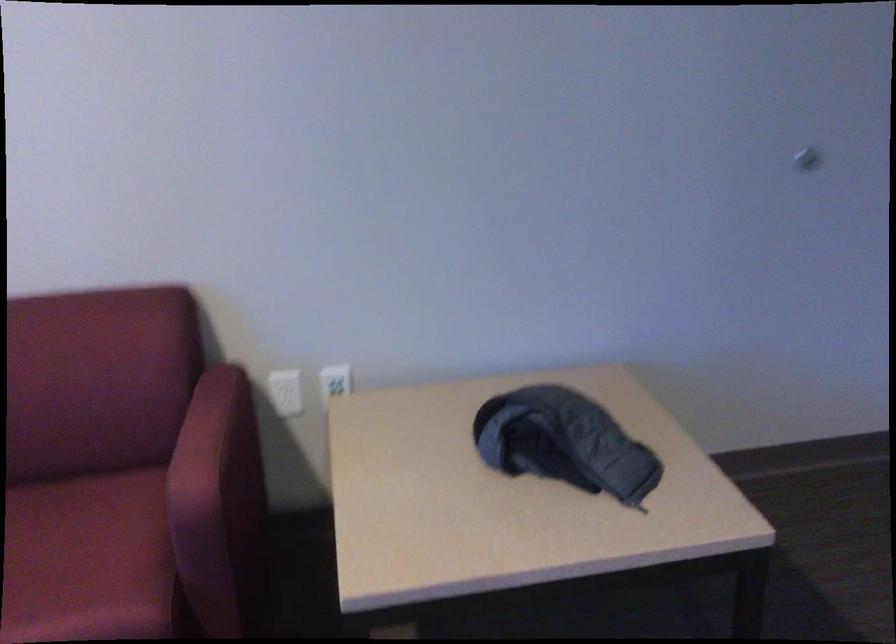
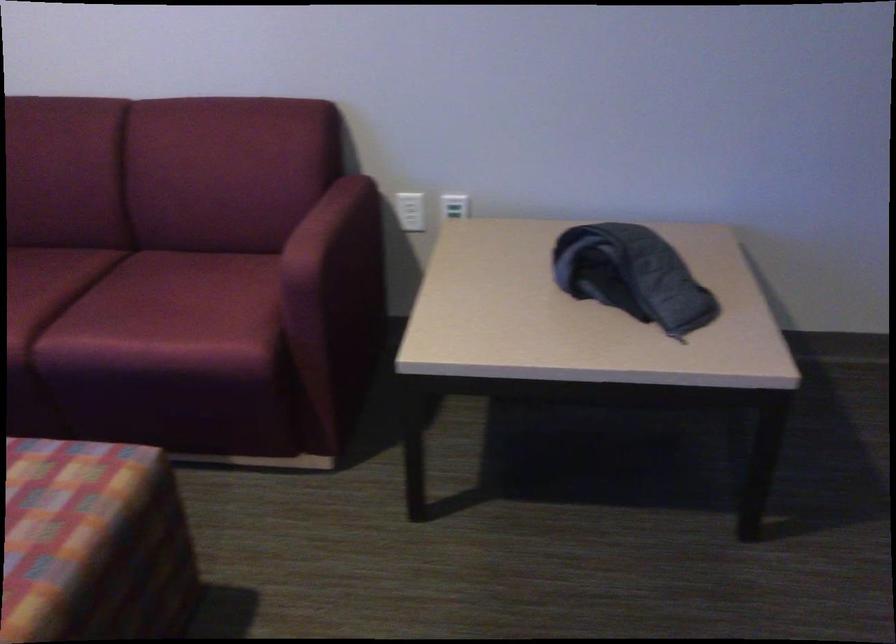
Question: The camera is either moving clockwise (left) or counter-clockwise (right) around the object. The first image is from the beginning of the video and the second image is from the end. Is the camera moving left or right when shooting the video?

Choices:
 (A) Left
 (B) Right

Answer: (B)